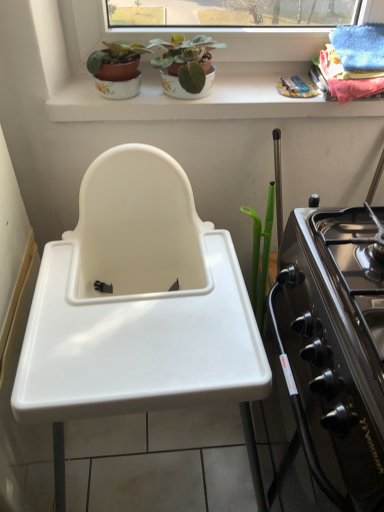
You are a GUI agent. You are given a task and a screenshot of the screen. Output one action in this format:
    pyautogui.click(x=<x>, y=<y>)
    Task: Click on the vacant space situated above white ceramic window sill at upper center (from a real-world perspective)
    The height and width of the screenshot is (512, 384).
    Given the screenshot: What is the action you would take?
    pyautogui.click(x=210, y=84)